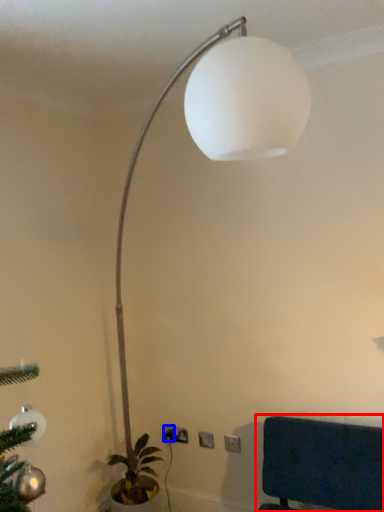
Question: Which object is closer to the camera taking this photo, furniture (highlighted by a red box) or electric outlet (highlighted by a blue box)?

Choices:
 (A) furniture
 (B) electric outlet

Answer: (A)